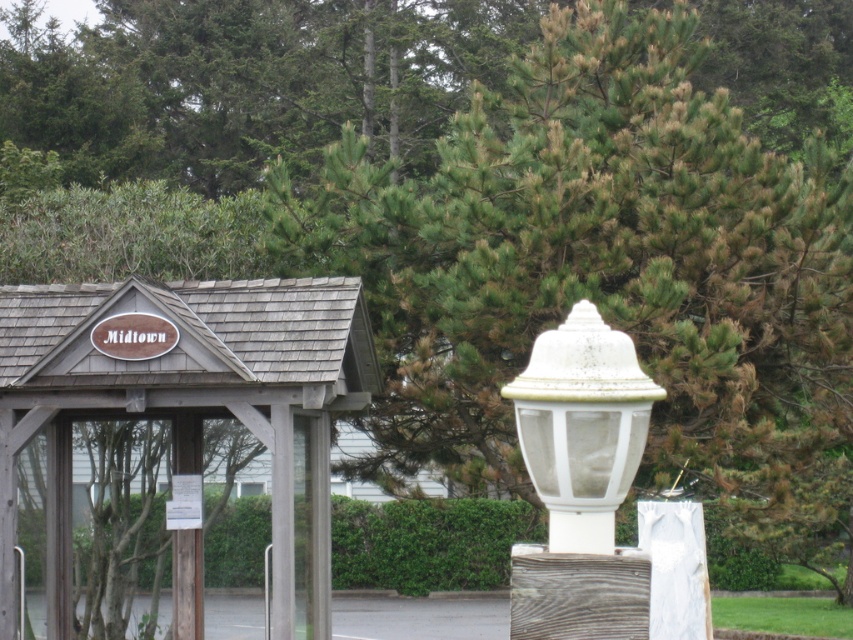
Question: Which point appears closest to the camera in this image?

Choices:
 (A) (566, 541)
 (B) (78, 369)

Answer: (A)

Question: Does wooden sign at center come in front of white matte lamp post at center?

Choices:
 (A) no
 (B) yes

Answer: (A)

Question: Which of the following is the farthest from the observer?

Choices:
 (A) wooden sign at center
 (B) white matte lamp post at center

Answer: (A)

Question: Is wooden sign at center bigger than white matte lamp post at center?

Choices:
 (A) no
 (B) yes

Answer: (B)

Question: From the image, what is the correct spatial relationship of wooden sign at center in relation to white matte lamp post at center?

Choices:
 (A) right
 (B) left

Answer: (B)